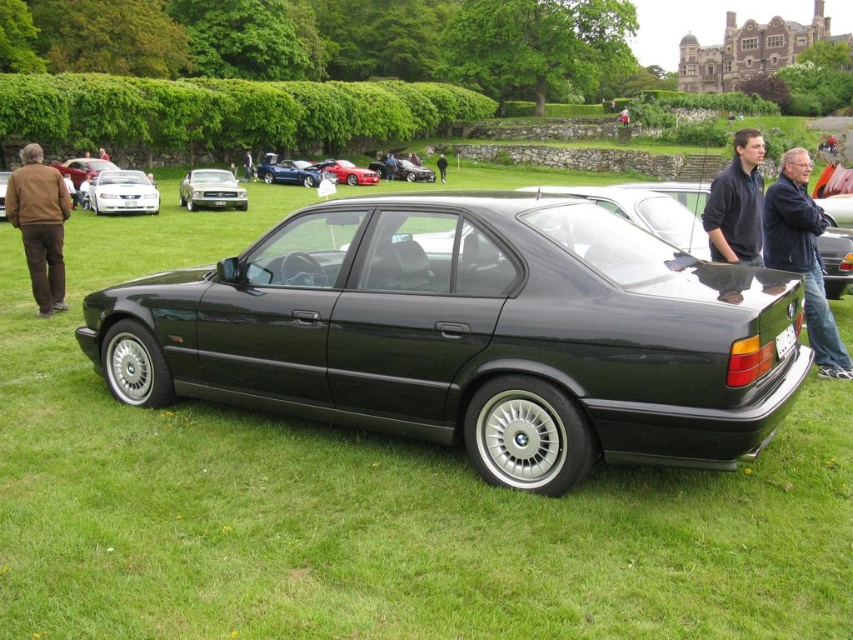
Question: Which of the following is the farthest from the observer?

Choices:
 (A) black leather jacket at center
 (B) shiny blue car at center
 (C) white plastic license plate at rear
 (D) shiny metallic car at center

Answer: (A)

Question: Is glossy black sedan at center to the right of shiny silver car at center from the viewer's perspective?

Choices:
 (A) yes
 (B) no

Answer: (A)

Question: In this image, where is shiny red car at center located relative to matte white car at center?

Choices:
 (A) left
 (B) right

Answer: (B)

Question: Which object is farther from the camera taking this photo?

Choices:
 (A) shiny blue car at center
 (B) white plastic license plate at rear

Answer: (A)

Question: Does dark blue sweater at center have a smaller size compared to white plastic license plate at rear?

Choices:
 (A) no
 (B) yes

Answer: (A)

Question: Which point is closer to the camera?

Choices:
 (A) white plastic license plate at rear
 (B) matte black sedan at center
 (C) shiny metallic car at center
 (D) black leather jacket at center

Answer: (A)